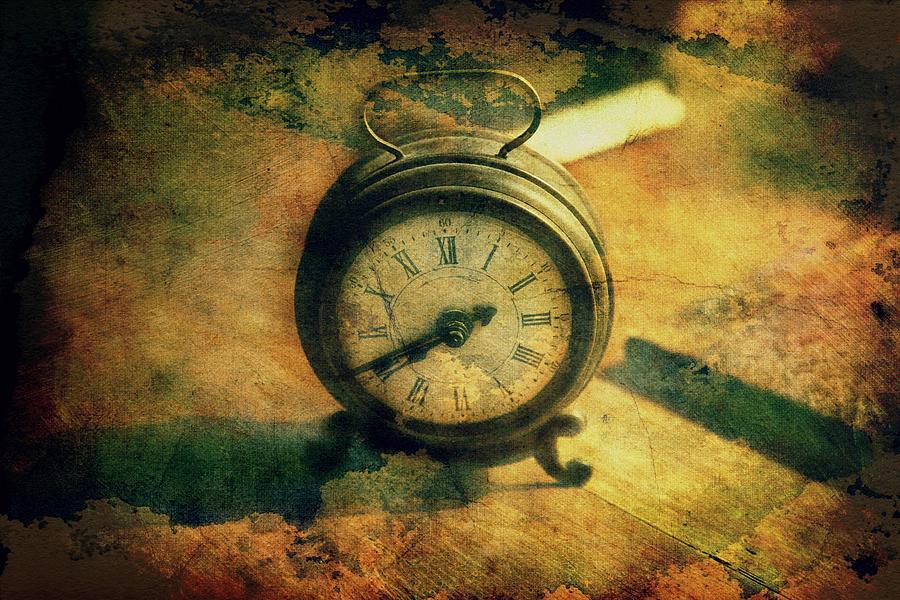
Identify the location of black shadow of alarm clock on lower left side. This screenshot has height=600, width=900. (294, 462), (218, 462), (127, 444).